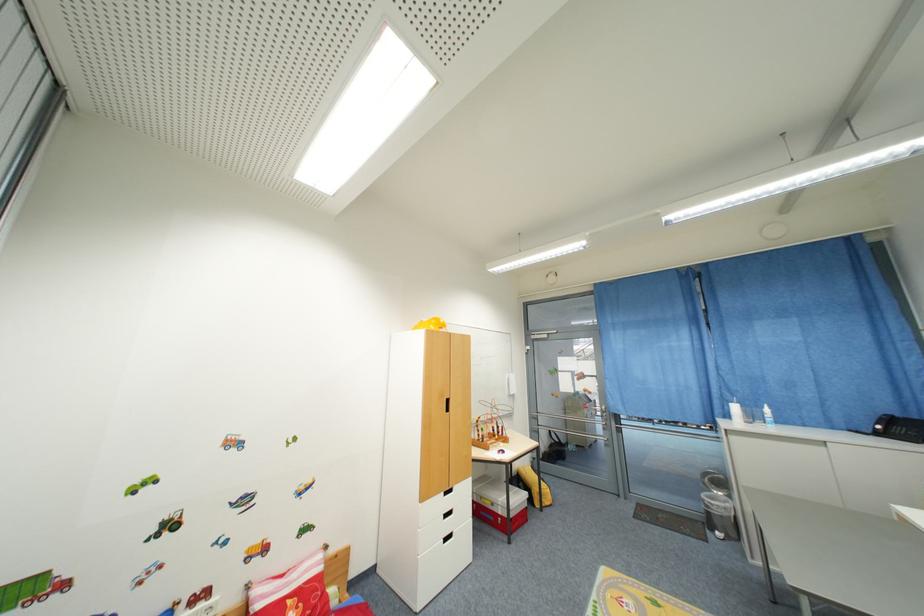
This screenshot has height=616, width=924. Describe the element at coordinates (882, 424) in the screenshot. I see `a telephone handset` at that location.